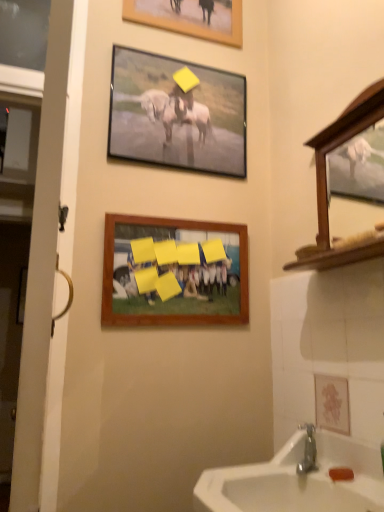
Question: Could you tell me if white wooden door at left is facing wooden picture frame at center, positioned as the 3th picture frame in top-to-bottom order?

Choices:
 (A) no
 (B) yes

Answer: (A)

Question: Does white wooden door at left have a larger size compared to wooden picture frame at center, positioned as the 3th picture frame in top-to-bottom order?

Choices:
 (A) no
 (B) yes

Answer: (B)

Question: Is white wooden door at left smaller than wooden picture frame at center, positioned as the 3th picture frame in top-to-bottom order?

Choices:
 (A) yes
 (B) no

Answer: (B)

Question: Is wooden picture frame at center, which is counted as the first picture frame, starting from the bottom, located within white wooden door at left?

Choices:
 (A) no
 (B) yes

Answer: (A)

Question: Is white wooden door at left facing away from wooden picture frame at center, positioned as the 3th picture frame in top-to-bottom order?

Choices:
 (A) yes
 (B) no

Answer: (A)

Question: Considering the relative sizes of white wooden door at left and wooden picture frame at center, which is counted as the first picture frame, starting from the bottom, in the image provided, is white wooden door at left taller than wooden picture frame at center, which is counted as the first picture frame, starting from the bottom,?

Choices:
 (A) no
 (B) yes

Answer: (B)

Question: Is metallic silver frame at upper center, which is the 2th picture frame from bottom to top, oriented towards wooden picture frame at center, which is counted as the first picture frame, starting from the bottom?

Choices:
 (A) yes
 (B) no

Answer: (B)

Question: Does metallic silver frame at upper center, which is the 2th picture frame from bottom to top, come behind wooden picture frame at center, which is counted as the first picture frame, starting from the bottom?

Choices:
 (A) yes
 (B) no

Answer: (A)

Question: Does metallic silver frame at upper center, which is the 2th picture frame from bottom to top, come in front of wooden picture frame at center, positioned as the 3th picture frame in top-to-bottom order?

Choices:
 (A) yes
 (B) no

Answer: (B)

Question: Does metallic silver frame at upper center, positioned as the 2th picture frame in top-to-bottom order, have a smaller size compared to wooden picture frame at center, which is counted as the first picture frame, starting from the bottom?

Choices:
 (A) no
 (B) yes

Answer: (A)

Question: Does metallic silver frame at upper center, which is the 2th picture frame from bottom to top, have a larger size compared to wooden picture frame at center, which is counted as the first picture frame, starting from the bottom?

Choices:
 (A) yes
 (B) no

Answer: (A)

Question: Is metallic silver frame at upper center, which is the 2th picture frame from bottom to top, outside of wooden picture frame at center, positioned as the 3th picture frame in top-to-bottom order?

Choices:
 (A) yes
 (B) no

Answer: (A)

Question: Does wooden picture frame at upper center, marked as the third picture frame in a bottom-to-top arrangement, have a lesser width compared to metallic silver frame at upper center, which is the 2th picture frame from bottom to top?

Choices:
 (A) yes
 (B) no

Answer: (A)